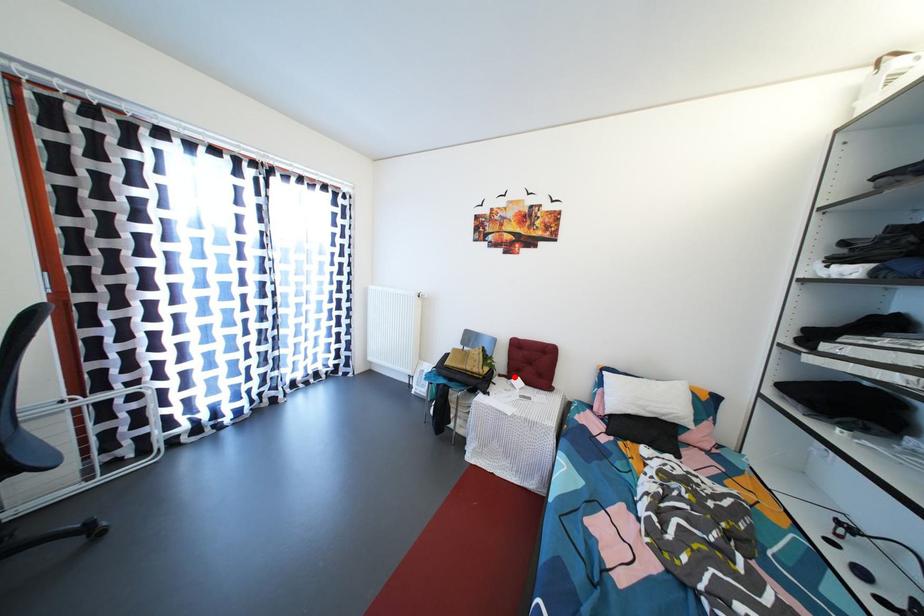
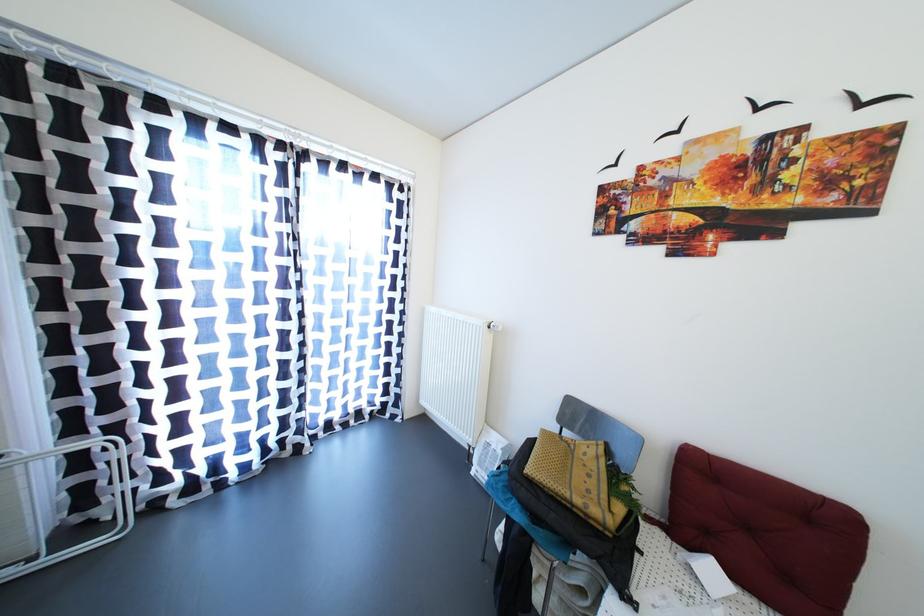
Question: A red point is marked in image1. In image2, is the corresponding 3D point closer to the camera or farther? Reply with the corresponding letter.

Choices:
 (A) The corresponding 3D point is closer.
 (B) The corresponding 3D point is farther.

Answer: (A)